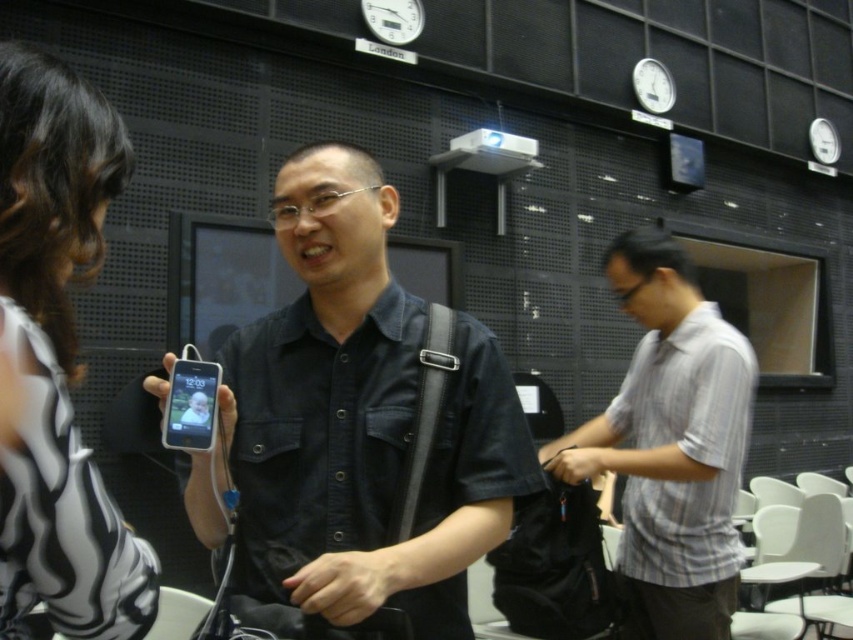
Question: Which object appears closest to the camera in this image?

Choices:
 (A) black denim shirt at center
 (B) gray striped shirt at right

Answer: (A)

Question: Does white printed blouse at upper left appear on the right side of gray striped shirt at right?

Choices:
 (A) yes
 (B) no

Answer: (B)

Question: Which object is positioned farthest from the gray striped shirt at right?

Choices:
 (A) black denim shirt at center
 (B) white printed blouse at upper left

Answer: (B)

Question: Is white printed blouse at upper left further to the viewer compared to gray striped shirt at right?

Choices:
 (A) no
 (B) yes

Answer: (A)

Question: Estimate the real-world distances between objects in this image. Which object is farther from the gray striped shirt at right?

Choices:
 (A) white printed blouse at upper left
 (B) black denim shirt at center

Answer: (A)

Question: Does black denim shirt at center have a larger size compared to white printed blouse at upper left?

Choices:
 (A) yes
 (B) no

Answer: (A)